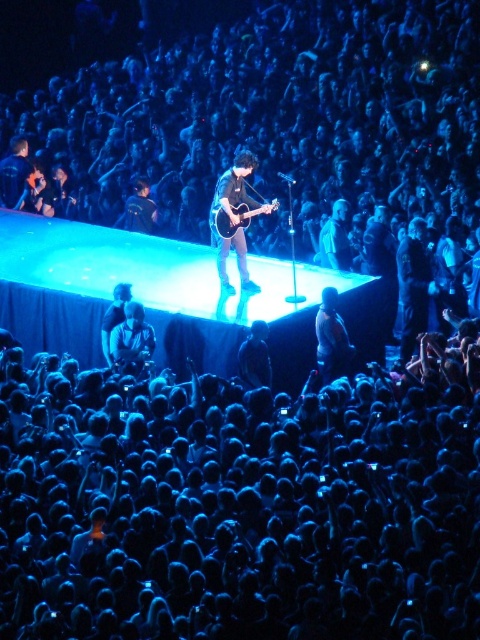
Question: From the image, what is the correct spatial relationship of dark blue fabric at lower right in relation to glossy wood guitar at center?

Choices:
 (A) below
 (B) above

Answer: (A)

Question: From the image, what is the correct spatial relationship of shiny black guitar at center in relation to glossy wood guitar at center?

Choices:
 (A) below
 (B) above

Answer: (A)

Question: Which point is farther from the camera taking this photo?

Choices:
 (A) (239, 216)
 (B) (243, 252)

Answer: (B)

Question: Which is nearer to the shiny silver guitar at center?

Choices:
 (A) glossy wood guitar at center
 (B) shiny black guitar at center
 (C) dark blue fabric at lower right

Answer: (B)

Question: Which point appears farthest from the camera in this image?

Choices:
 (A) (248, 208)
 (B) (131, 372)

Answer: (A)

Question: In this image, where is shiny black guitar at center located relative to dark blue fabric at lower right?

Choices:
 (A) above
 (B) below

Answer: (A)